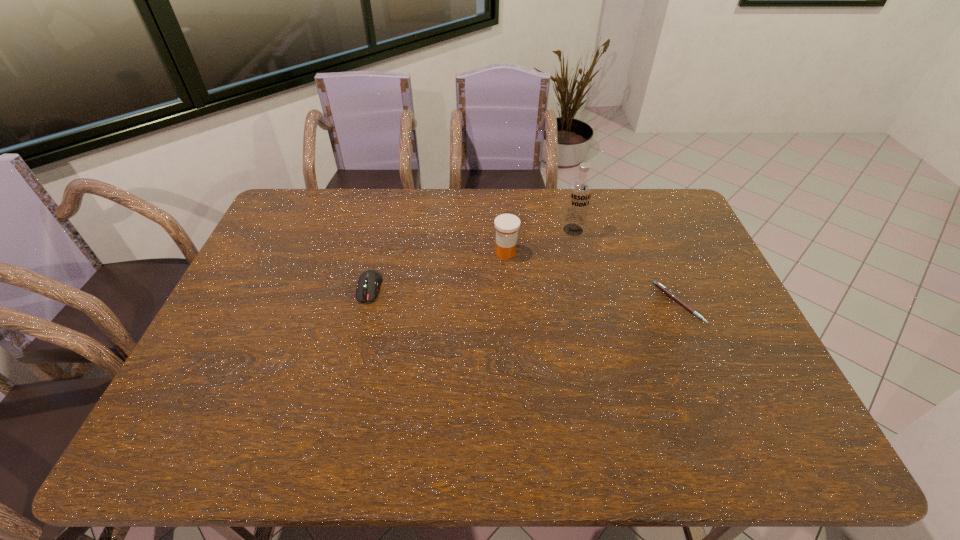
The image size is (960, 540). Identify the location of vacant space on the desktop that is between the computer equipment and the pen and is positioned on the front label of the vodka. (557, 297).

This screenshot has height=540, width=960. What are the coordinates of `free space on the desktop that is between the computer equipment and the rightmost object and is positioned on the label of the medicine` in the screenshot? It's located at (477, 293).